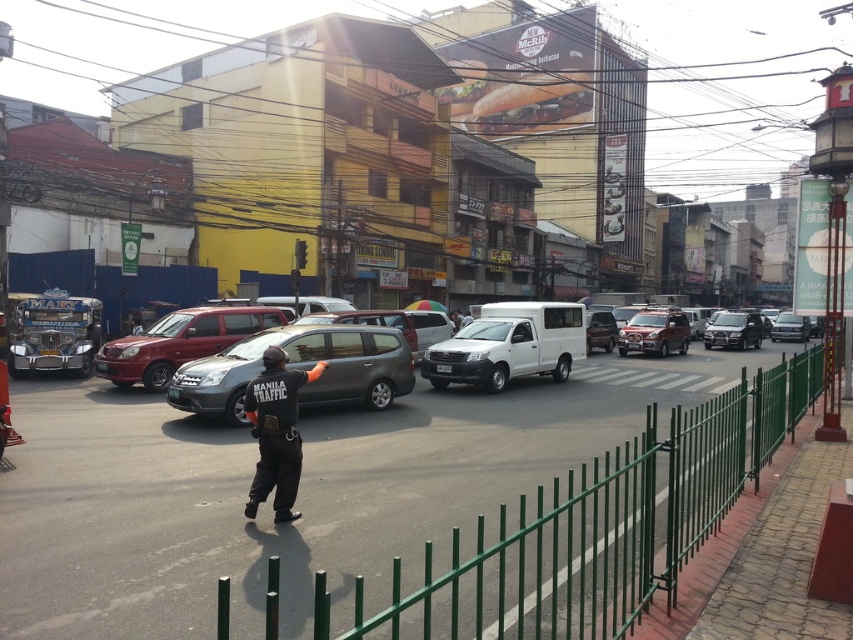
Is point (350, 324) positioned before point (215, 337)?

Yes, point (350, 324) is in front of point (215, 337).

Is satin silver van at center to the right of matte red suv at center from the viewer's perspective?

Indeed, satin silver van at center is positioned on the right side of matte red suv at center.

Is point (352, 346) positioned in front of point (169, 362)?

Yes, it is.

The image size is (853, 640). In order to click on satin silver van at center in this screenshot , I will do `click(299, 369)`.

Is point (250, 385) closer to viewer compared to point (607, 310)?

Yes.

Can you confirm if black uniform at center is positioned to the left of matte white van at center?

Indeed, black uniform at center is positioned on the left side of matte white van at center.

Measure the distance between point [283,419] and camera.

Point [283,419] and camera are 6.97 meters apart from each other.

Find the location of a particular element. This screenshot has width=853, height=640. black uniform at center is located at coordinates (276, 433).

How distant is white matte van at center from black uniform at center?

10.25 meters

Can you confirm if white matte van at center is thinner than black uniform at center?

Incorrect, white matte van at center's width is not less than black uniform at center's.

Does point (434, 355) come in front of point (270, 387)?

No.

Find the location of a particular element. Image resolution: width=853 pixels, height=640 pixels. white matte van at center is located at coordinates (509, 346).